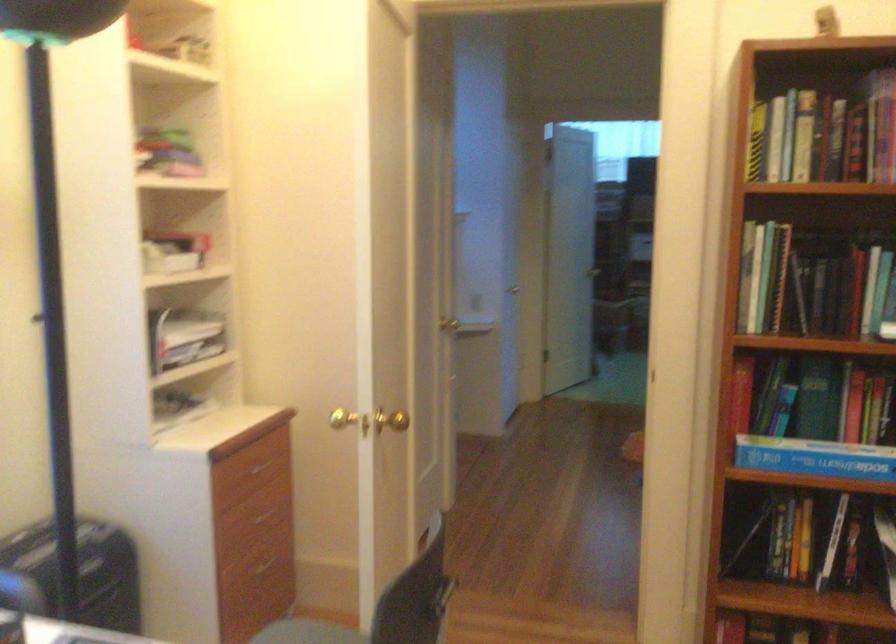
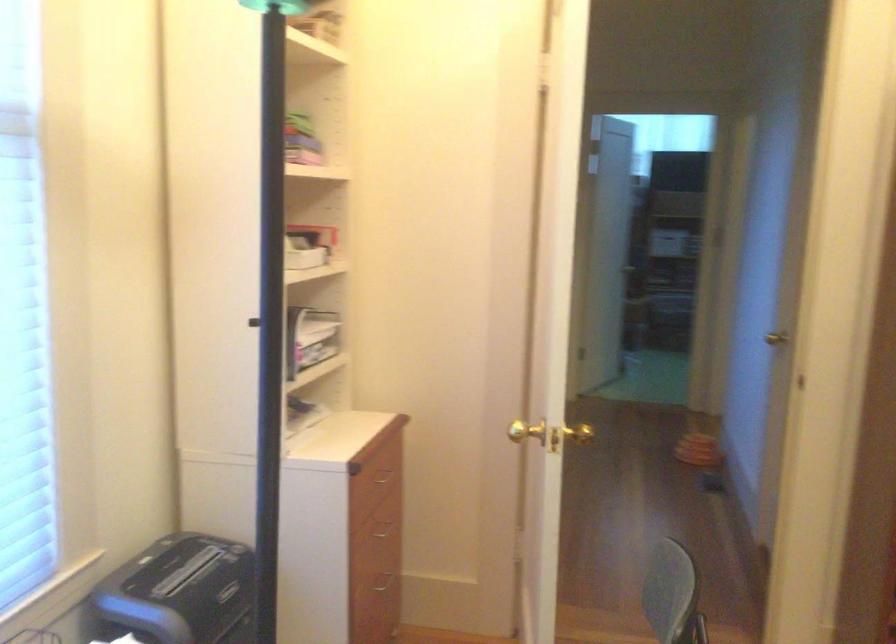
Find the pixel in the second image that matches the point at 261,573 in the first image.

(382, 587)